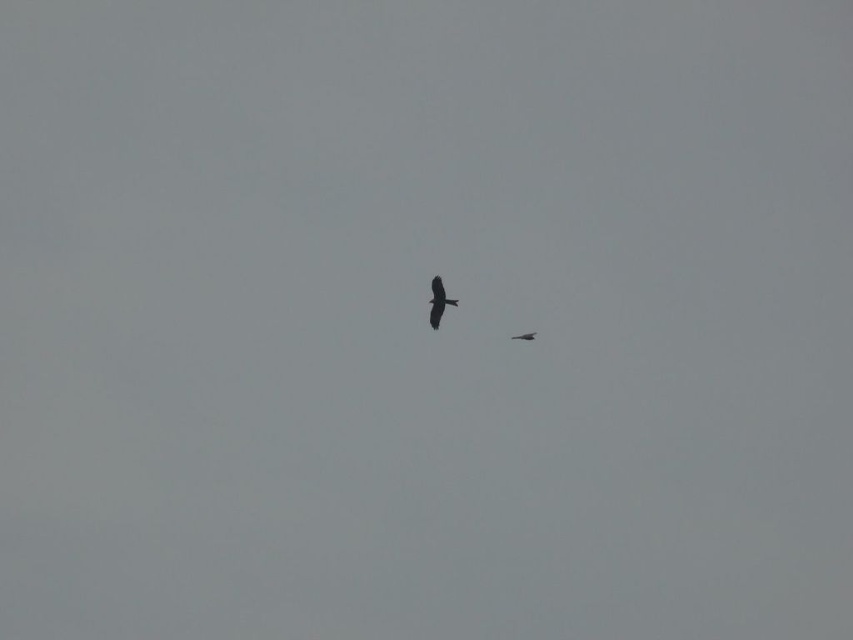
Question: Does black matte crow at center appear under dark brown feathered bird at center?

Choices:
 (A) yes
 (B) no

Answer: (B)

Question: Is black matte crow at center to the left of dark brown feathered bird at center from the viewer's perspective?

Choices:
 (A) yes
 (B) no

Answer: (A)

Question: Is black matte crow at center bigger than dark brown feathered bird at center?

Choices:
 (A) yes
 (B) no

Answer: (A)

Question: Which point is closer to the camera?

Choices:
 (A) black matte crow at center
 (B) dark brown feathered bird at center

Answer: (A)